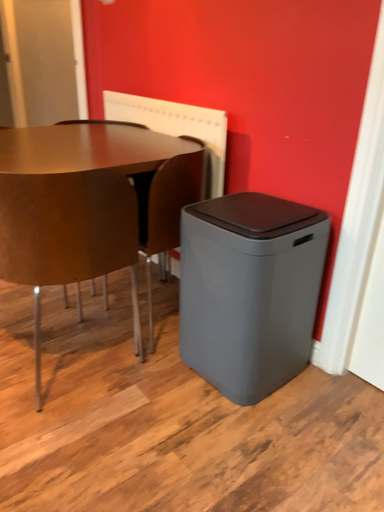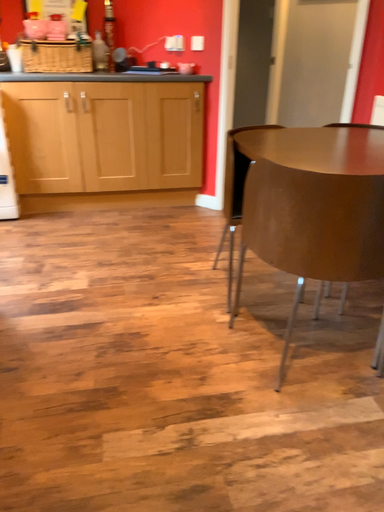
Question: How did the camera likely rotate when shooting the video?

Choices:
 (A) rotated right
 (B) rotated left

Answer: (B)